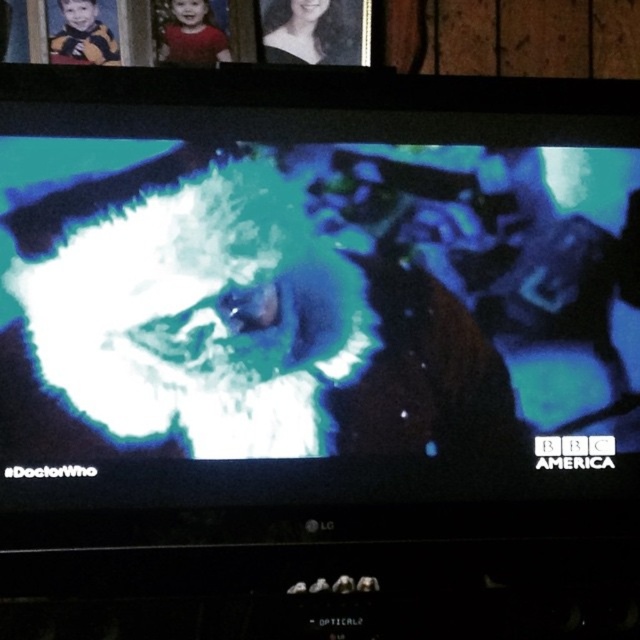
Does white foggy cloud at center appear under yellow-orange sweater at upper left?

Indeed, white foggy cloud at center is positioned under yellow-orange sweater at upper left.

Does point (317, 227) lie in front of point (99, 36)?

That is True.

Is point (54, 385) in front of point (67, 3)?

Yes, it is.

You are a GUI agent. You are given a task and a screenshot of the screen. Output one action in this format:
    pyautogui.click(x=<x>, y=<y>)
    Task: Click on the white foggy cloud at center
    The image size is (640, 640).
    Given the screenshot: What is the action you would take?
    pyautogui.click(x=310, y=320)

Between red matte shirt at upper center and yellow-orange sweater at upper left, which one is positioned higher?

red matte shirt at upper center is above.

Who is lower down, red matte shirt at upper center or yellow-orange sweater at upper left?

Positioned lower is yellow-orange sweater at upper left.

What do you see at coordinates (188, 33) in the screenshot? This screenshot has height=640, width=640. I see `red matte shirt at upper center` at bounding box center [188, 33].

Find the location of a particular element. The image size is (640, 640). red matte shirt at upper center is located at coordinates (188, 33).

How much distance is there between black matte hair at upper center and red matte shirt at upper center?

The distance of black matte hair at upper center from red matte shirt at upper center is 5.07 inches.

Does point (288, 28) come farther from viewer compared to point (216, 52)?

That is True.

This screenshot has width=640, height=640. What do you see at coordinates (301, 32) in the screenshot?
I see `black matte hair at upper center` at bounding box center [301, 32].

Where is `black matte hair at upper center`? black matte hair at upper center is located at coordinates (301, 32).